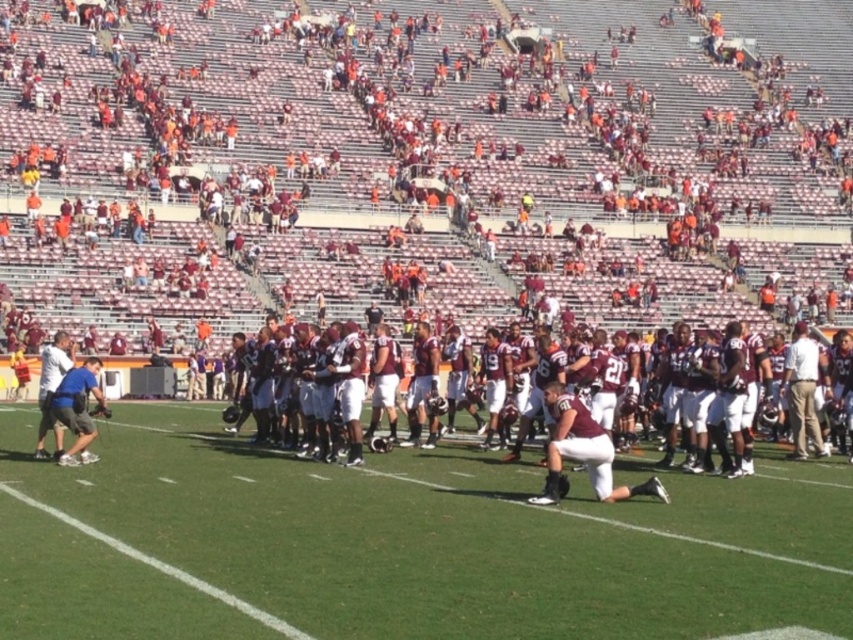
You are a drone operator trying to capture a photo of the football team huddle. The camera is currently focused on the white smooth grass at center. To ensure the entire team is in frame, should you adjust the camera to pan left or right?

The white smooth grass at center is located at point 0.853 on the x axis, which is to the right of the center point. To include the entire team in the frame, you should pan the camera slightly to the left to shift the focus back towards the center of the field.

You are a photographer standing on the sidelines of the football field. You want to capture a photo of the white smooth grass at center and the maroon jersey at center. Which object should you zoom in on to ensure both are clearly visible in the frame?

The white smooth grass at center is smaller than the maroon jersey at center, so you should zoom in on the maroon jersey at center to ensure both are clearly visible in the frame.

You are a photographer positioned at the origin of the field. You need to take a photo that includes both the point at point (155, 412) and the point at point (639, 467). Which point is closer to you?

Point (155, 412) is behind point (639, 467), so the point at point (639, 467) is closer to you.